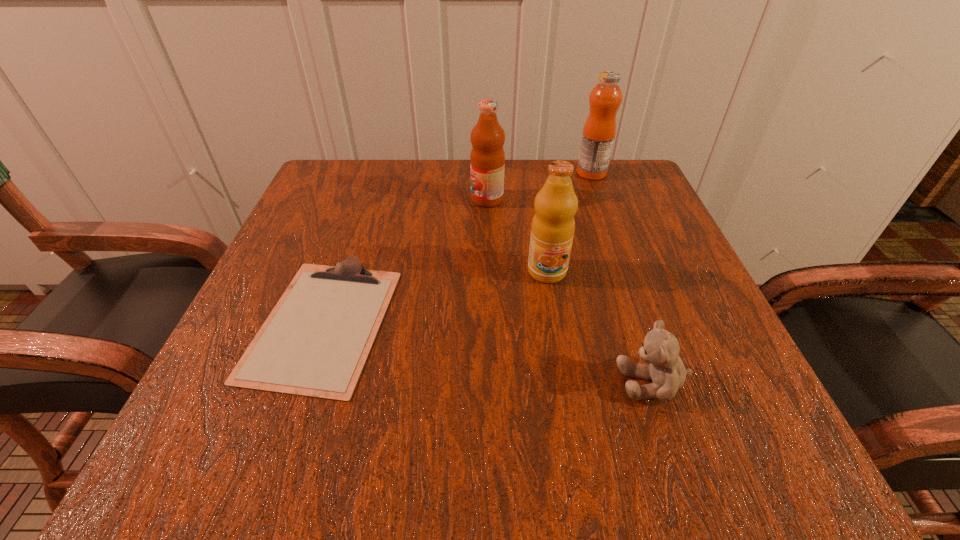
Locate an element on the screen. teddy bear at the right edge is located at coordinates (660, 348).

I want to click on object that is at the far right corner, so click(599, 130).

Where is `free space at the far edge of the desktop`? free space at the far edge of the desktop is located at coordinates (509, 170).

The image size is (960, 540). In the image, there is a desktop. What are the coordinates of `vacant space at the left edge` in the screenshot? It's located at (354, 225).

In the image, there is a desktop. Where is `vacant region at the right edge`? This screenshot has width=960, height=540. vacant region at the right edge is located at coordinates (628, 246).

At what (x,y) coordinates should I click in order to perform the action: click on vacant space at the far left corner of the desktop. Please return your answer as a coordinate pair (x, y). Looking at the image, I should click on (333, 172).

Where is `blank area at the near left corner`? blank area at the near left corner is located at coordinates (276, 456).

This screenshot has width=960, height=540. Find the location of `vacant space at the far right corner of the desktop`. vacant space at the far right corner of the desktop is located at coordinates (658, 216).

I want to click on vacant area that lies between the second object from left to right and the fourth tallest object, so click(570, 291).

Identify the location of empty space that is in between the farthest object and the teddy bear. click(x=622, y=278).